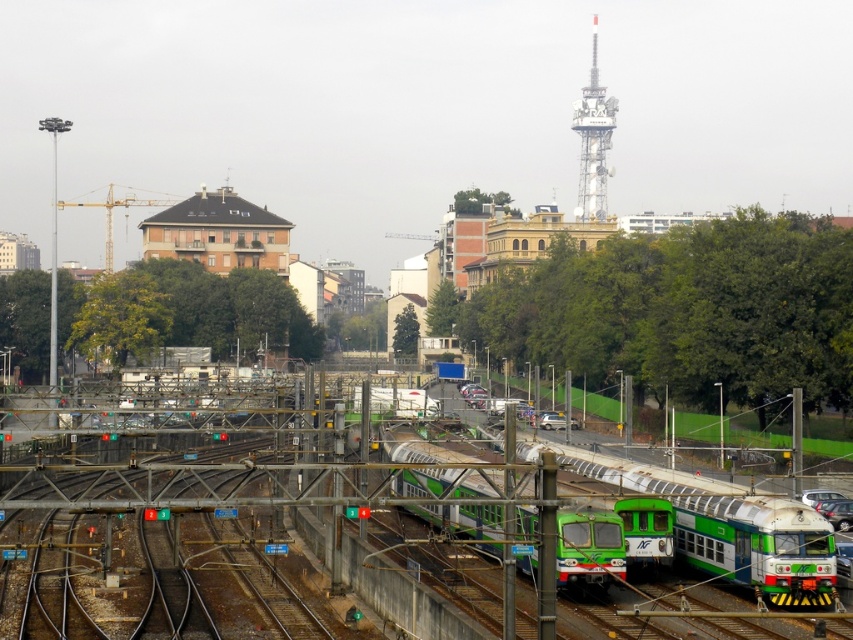
You are a railway inspector checking the tracks. You notice two trains, the green matte train at center and the green metallic train at center. Which one is directly above the other?

The green matte train at center is positioned over the green metallic train at center.